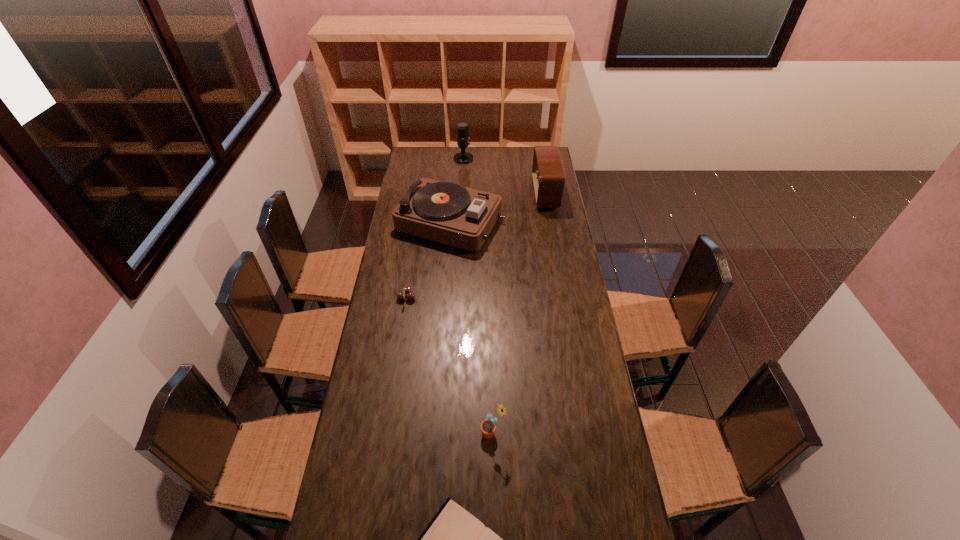
This screenshot has height=540, width=960. I want to click on free space at the left edge of the desktop, so click(x=387, y=324).

You are a GUI agent. You are given a task and a screenshot of the screen. Output one action in this format:
    pyautogui.click(x=<x>, y=<y>)
    Task: Click on the free location at the right edge of the desktop
    The width and height of the screenshot is (960, 540).
    Given the screenshot: What is the action you would take?
    pyautogui.click(x=581, y=362)

In order to click on vacant area that lies between the second nearest object and the rightmost object in this screenshot , I will do (x=518, y=313).

Locate an element on the screen. The height and width of the screenshot is (540, 960). vacant point located between the microphone and the rightmost object is located at coordinates (504, 176).

Locate an element on the screen. This screenshot has width=960, height=540. vacant area that lies between the record player and the sunflower is located at coordinates (471, 327).

Locate an element on the screen. This screenshot has height=540, width=960. vacant space in between the record player and the second nearest object is located at coordinates (471, 327).

Identify the location of free spot between the fifth farthest object and the cherry. The image size is (960, 540). (449, 365).

The width and height of the screenshot is (960, 540). Identify the location of free space between the fifth farthest object and the fourth farthest object. (449, 365).

Choose which object is the nearest neighbor to the shortest object. Please provide its 2D coordinates. Your answer should be formatted as a tuple, i.e. [(x, y)], where the tuple contains the x and y coordinates of a point satisfying the conditions above.

[(488, 426)]

Locate which object ranks fifth in proximity to the farthest object. Please provide its 2D coordinates. Your answer should be formatted as a tuple, i.e. [(x, y)], where the tuple contains the x and y coordinates of a point satisfying the conditions above.

[(454, 539)]